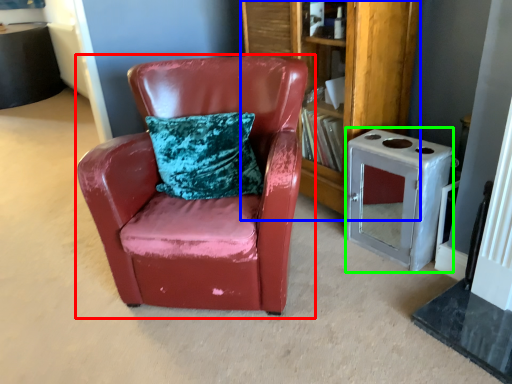
Question: Which object is positioned closest to chair (highlighted by a red box)? Select from bookshelf (highlighted by a blue box) and appliance (highlighted by a green box).

Choices:
 (A) bookshelf
 (B) appliance

Answer: (A)